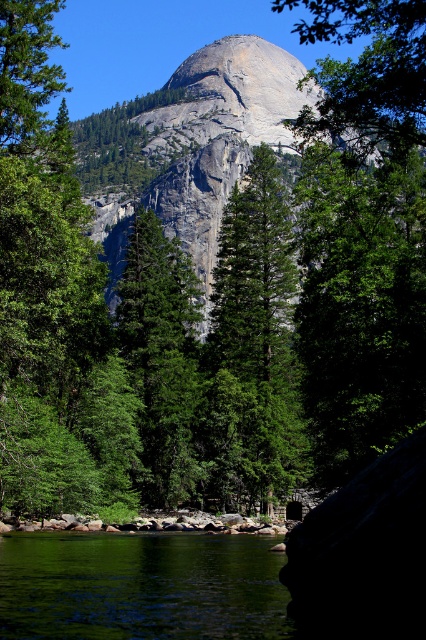
Does green textured tree at center have a larger size compared to green matte tree at center?

Yes, green textured tree at center is bigger than green matte tree at center.

Which of these two, green textured tree at center or green matte tree at center, stands taller?

green textured tree at center

Which is in front, point (271, 330) or point (178, 328)?

Positioned in front is point (271, 330).

Find the location of a particular element. This screenshot has width=426, height=640. green textured tree at center is located at coordinates (253, 346).

Between point (247, 474) and point (241, 134), which one is positioned behind?

Positioned behind is point (241, 134).

Looking at this image, can you confirm if green textured tree at center is smaller than gray granite mountain at center?

Correct, green textured tree at center occupies less space than gray granite mountain at center.

Does point (261, 474) come behind point (112, 212)?

No, it is in front of (112, 212).

Find the location of a particular element. The height and width of the screenshot is (640, 426). green textured tree at center is located at coordinates (253, 346).

Which is below, green smooth water at lower left or green textured tree at center?

green smooth water at lower left

Which is behind, point (247, 602) or point (264, 211)?

Positioned behind is point (264, 211).

I want to click on green smooth water at lower left, so click(x=141, y=586).